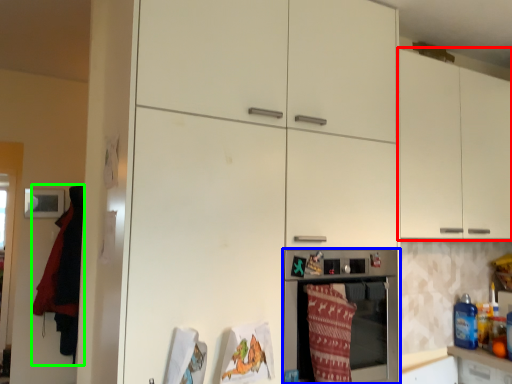
Question: Which object is the closest to the cabinetry (highlighted by a red box)? Choose among these: home appliance (highlighted by a blue box) or blanket (highlighted by a green box).

Choices:
 (A) home appliance
 (B) blanket

Answer: (A)